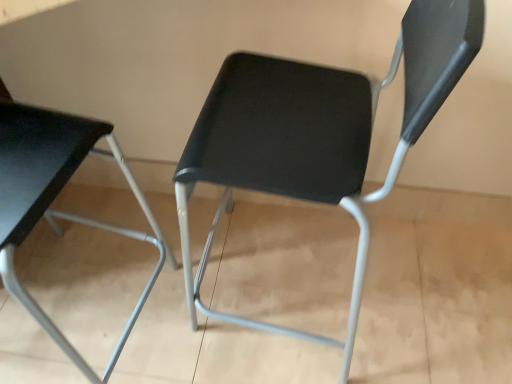
Find the location of a particular element. The height and width of the screenshot is (384, 512). blank area beneath matte black chair at left, which is counted as the 2th chair, starting from the right (from a real-world perspective) is located at coordinates (82, 314).